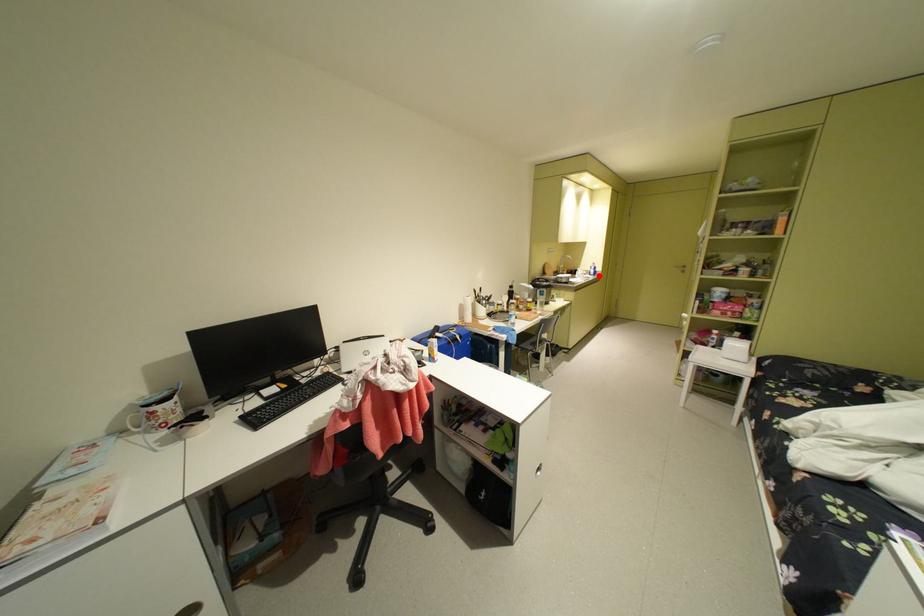
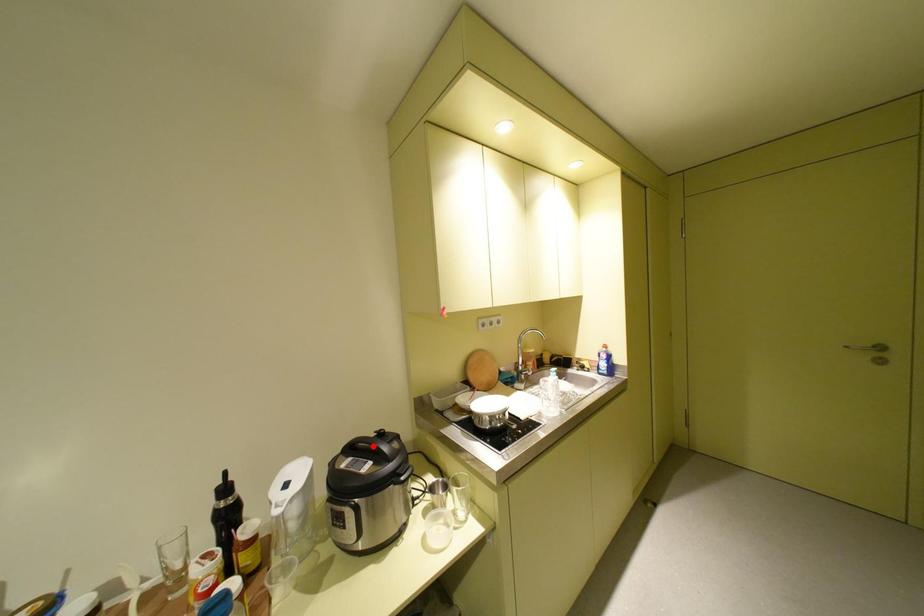
I am providing you with two images of the same scene from different viewpoints. A red point is marked on the first image and another point is marked on the second image. Is the marked point in image1 the same physical position as the marked point in image2?

No